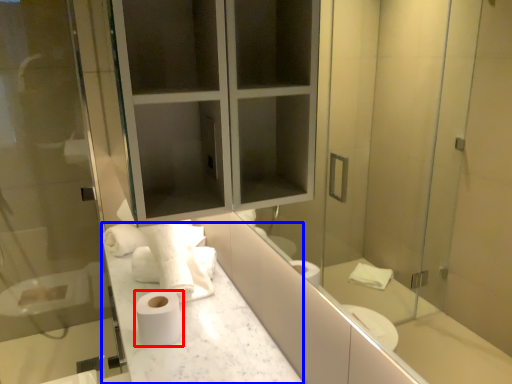
Question: Among these objects, which one is farthest to the camera, toilet paper (highlighted by a red box) or counter top (highlighted by a blue box)?

Choices:
 (A) toilet paper
 (B) counter top

Answer: (A)